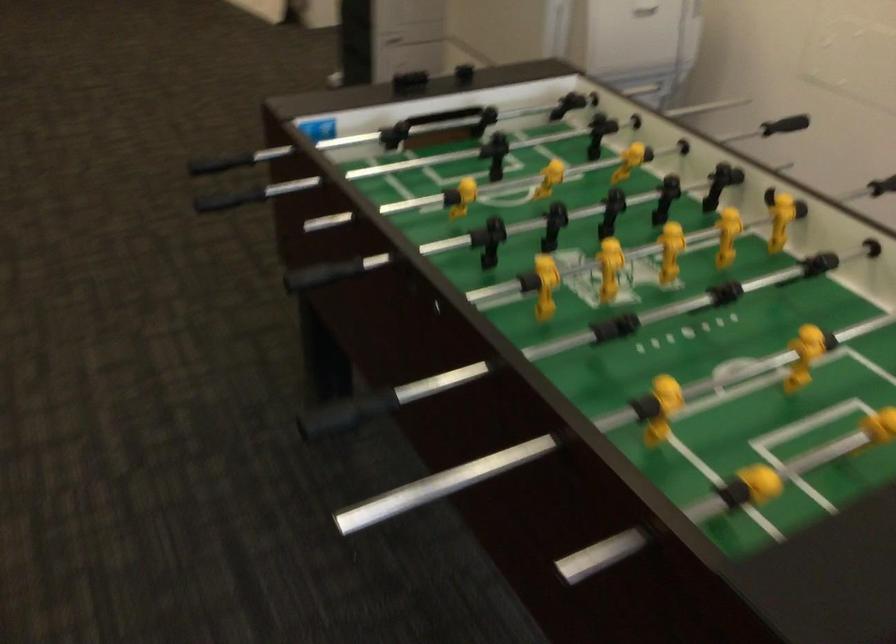
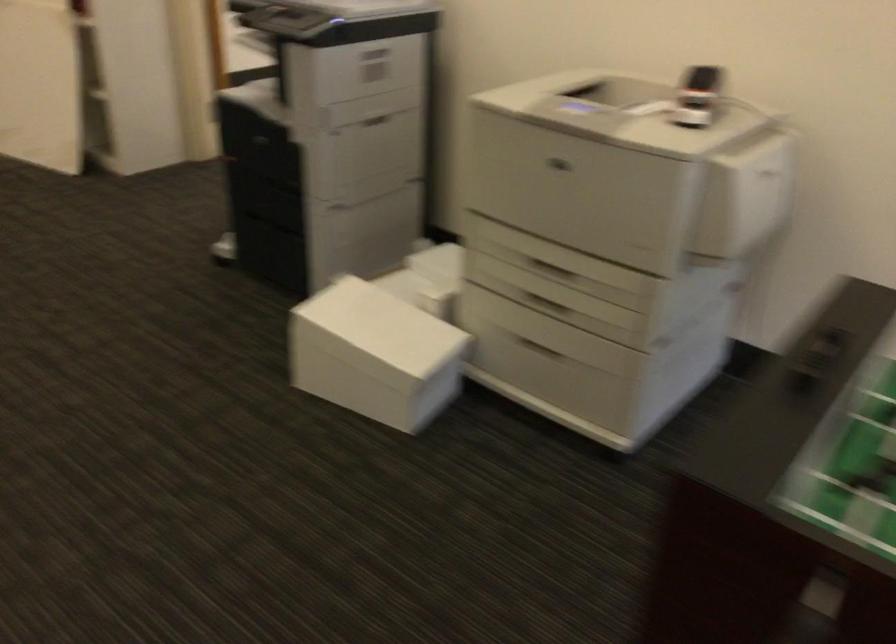
In a continuous first-person perspective shot, in which direction is the camera moving?

The movement direction of the cameraman is left, forward.